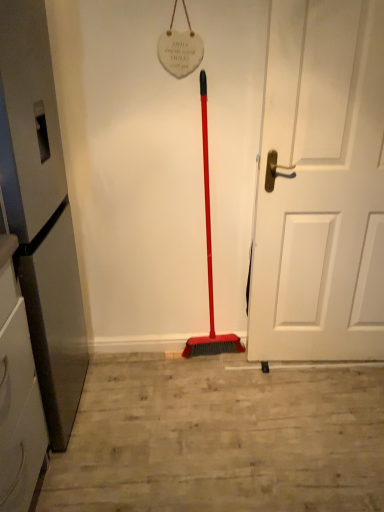
Where is `free space to the left of white matte door at center`? free space to the left of white matte door at center is located at coordinates (233, 388).